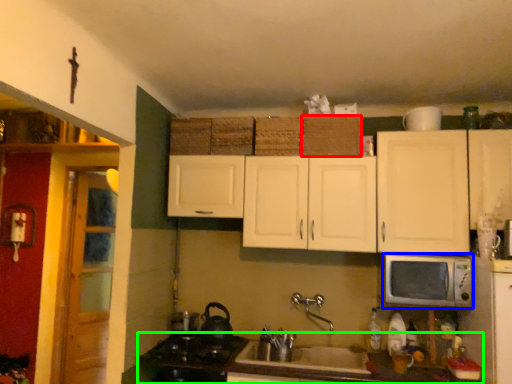
Question: Which object is positioned farthest from basket (highlighted by a red box)? Select from microwave oven (highlighted by a blue box) and countertop (highlighted by a green box).

Choices:
 (A) microwave oven
 (B) countertop

Answer: (B)